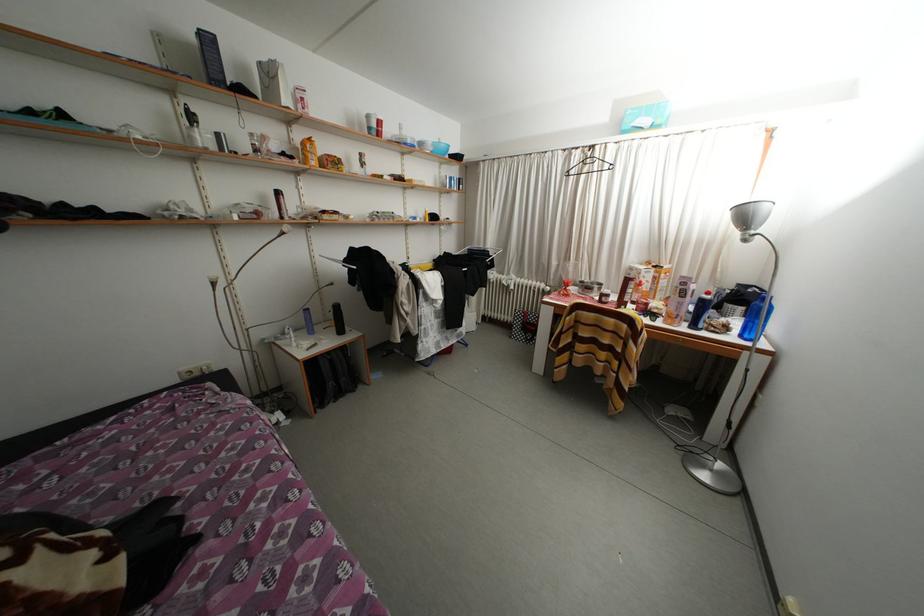
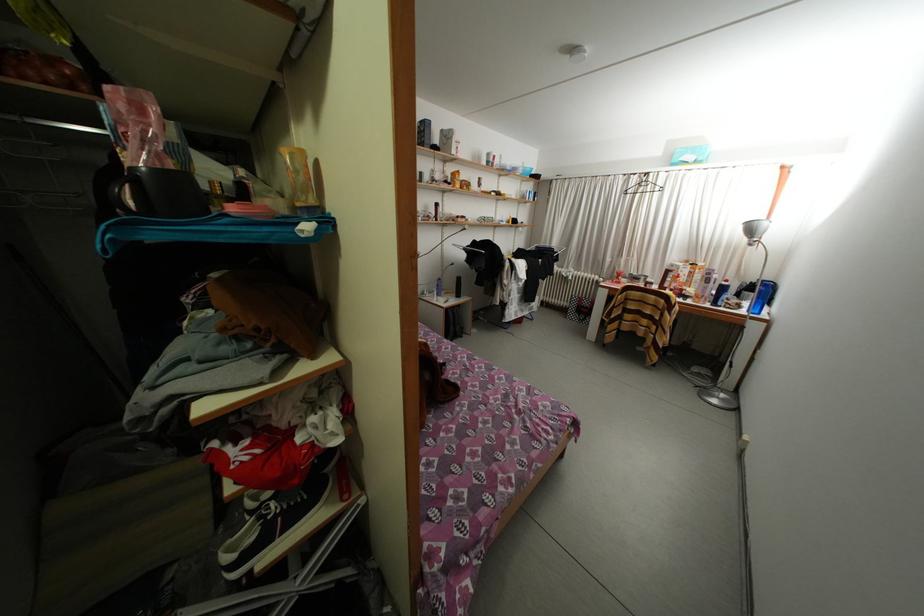
The point at [635,382] is marked in the first image. Where is the corresponding point in the second image?

(670, 342)